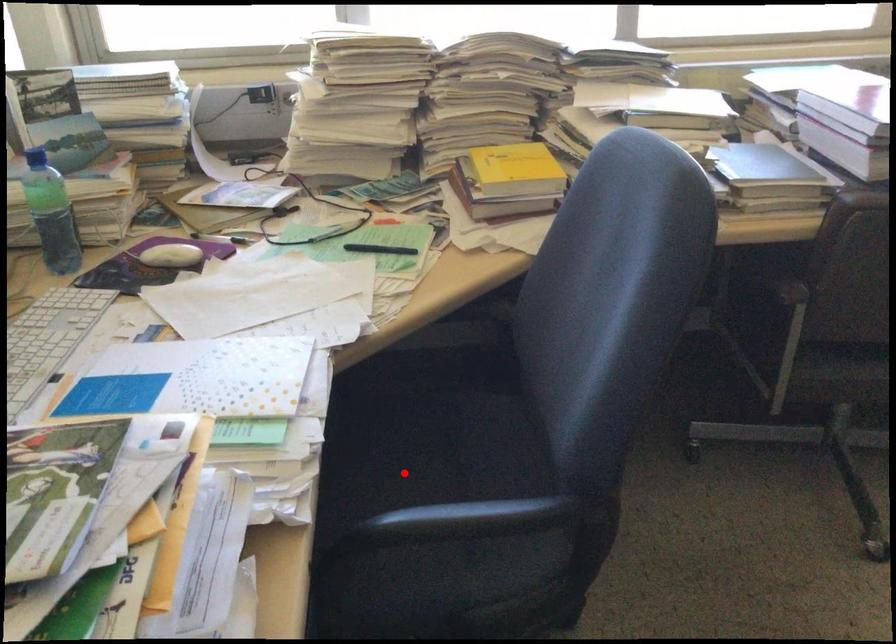
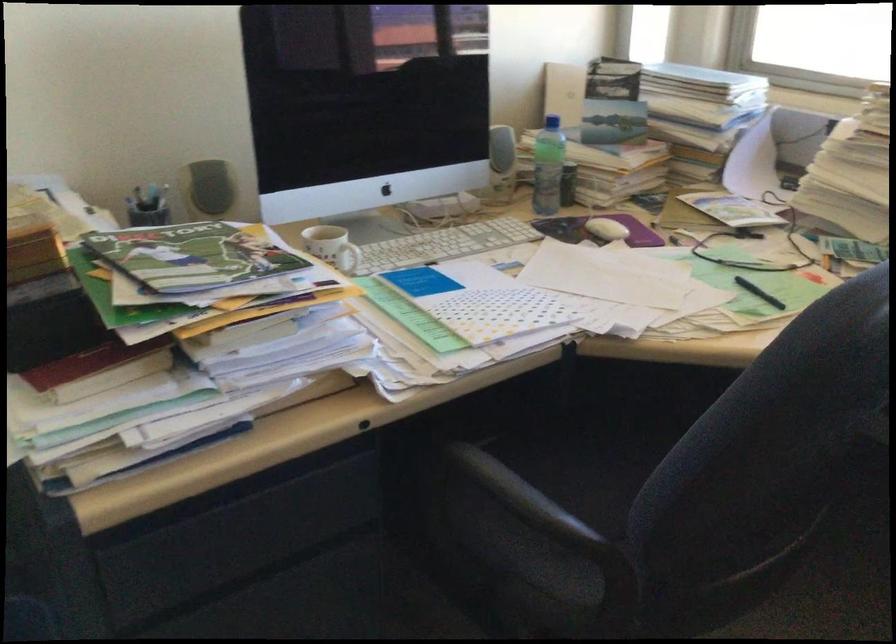
The point at the highlighted location is marked in the first image. Where is the corresponding point in the second image?

(616, 478)